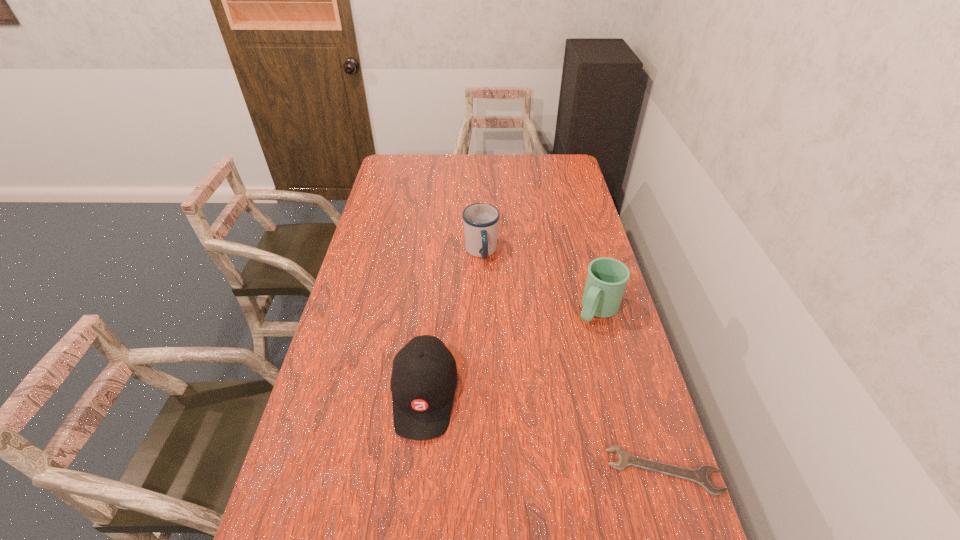
The height and width of the screenshot is (540, 960). Identify the location of vacant spot on the desktop that is between the baseball cap and the shortest object and is positioned on the handle side of the farthest object. (540, 431).

You are a GUI agent. You are given a task and a screenshot of the screen. Output one action in this format:
    pyautogui.click(x=<x>, y=<y>)
    Task: Click on the vacant spot on the desktop that is between the second nearest object and the wrench and is positioned on the side of the right mug with the handle
    The width and height of the screenshot is (960, 540).
    Given the screenshot: What is the action you would take?
    pyautogui.click(x=512, y=422)